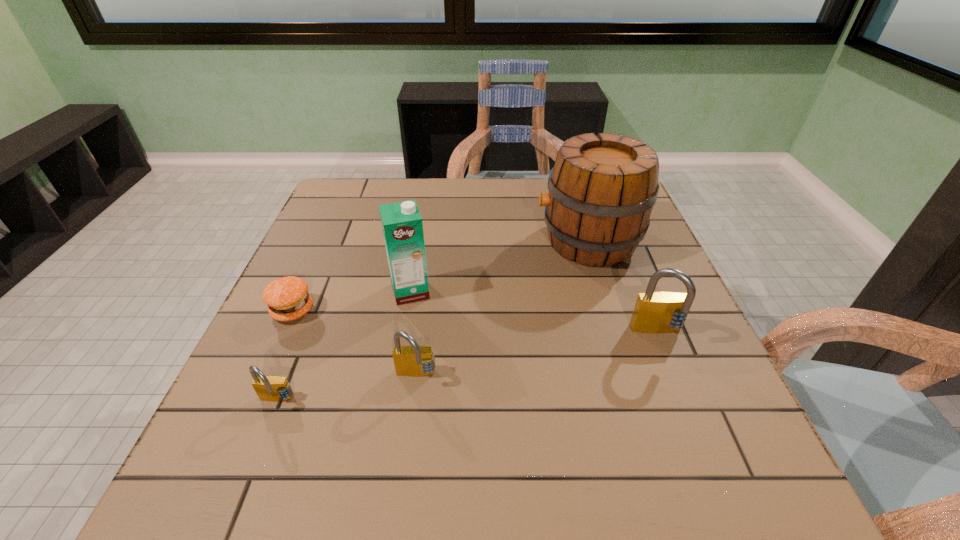
Find the location of a particular element. empty space that is in between the cider and the farthest padlock is located at coordinates (623, 287).

The width and height of the screenshot is (960, 540). Find the location of `free space that is in between the farthest object and the rightmost padlock`. free space that is in between the farthest object and the rightmost padlock is located at coordinates (623, 287).

Where is `free space between the second tallest padlock and the cider`? The image size is (960, 540). free space between the second tallest padlock and the cider is located at coordinates (502, 309).

Identify the location of vacant area between the patty and the fourth shortest object. This screenshot has height=540, width=960. (475, 322).

Locate an element on the screen. unoccupied position between the shortest object and the cider is located at coordinates (441, 276).

Locate an element on the screen. The width and height of the screenshot is (960, 540). vacant space that is in between the farthest object and the carton is located at coordinates (499, 266).

The image size is (960, 540). I want to click on free space that is in between the cider and the nearest object, so click(x=432, y=321).

This screenshot has height=540, width=960. I want to click on free space between the tallest padlock and the carton, so click(x=534, y=312).

Locate an element on the screen. The image size is (960, 540). unoccupied area between the nearest object and the cider is located at coordinates (432, 321).

Where is `vacant region between the carton and the tallest padlock`? The image size is (960, 540). vacant region between the carton and the tallest padlock is located at coordinates (534, 312).